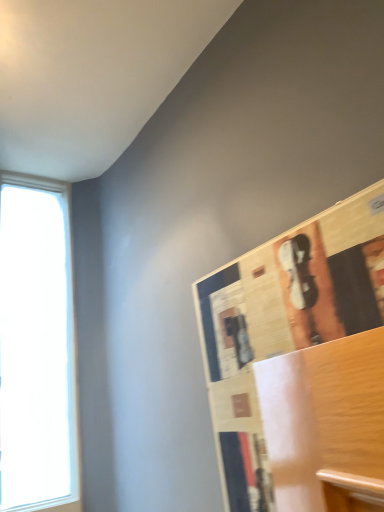
Question: Should I look upward or downward to see wooden bulletin board at upper right?

Choices:
 (A) down
 (B) up

Answer: (A)

Question: Does transparent glass window at left have a lesser width compared to wooden bulletin board at upper right?

Choices:
 (A) yes
 (B) no

Answer: (B)

Question: Is transparent glass window at left positioned far away from wooden bulletin board at upper right?

Choices:
 (A) yes
 (B) no

Answer: (B)

Question: From a real-world perspective, is transparent glass window at left physically below wooden bulletin board at upper right?

Choices:
 (A) no
 (B) yes

Answer: (A)

Question: Considering the relative positions of transparent glass window at left and wooden bulletin board at upper right in the image provided, is transparent glass window at left behind wooden bulletin board at upper right?

Choices:
 (A) yes
 (B) no

Answer: (A)

Question: From the image's perspective, does transparent glass window at left appear higher than wooden bulletin board at upper right?

Choices:
 (A) yes
 (B) no

Answer: (B)

Question: Does transparent glass window at left appear on the right side of wooden bulletin board at upper right?

Choices:
 (A) no
 (B) yes

Answer: (A)

Question: Is wooden bulletin board at upper right in front of transparent glass window at left?

Choices:
 (A) no
 (B) yes

Answer: (B)

Question: Can you confirm if wooden bulletin board at upper right is wider than transparent glass window at left?

Choices:
 (A) yes
 (B) no

Answer: (B)

Question: From a real-world perspective, is wooden bulletin board at upper right beneath transparent glass window at left?

Choices:
 (A) yes
 (B) no

Answer: (A)

Question: Does wooden bulletin board at upper right have a smaller size compared to transparent glass window at left?

Choices:
 (A) yes
 (B) no

Answer: (A)

Question: Is wooden bulletin board at upper right thinner than transparent glass window at left?

Choices:
 (A) no
 (B) yes

Answer: (B)

Question: From a real-world perspective, is wooden bulletin board at upper right located higher than transparent glass window at left?

Choices:
 (A) yes
 (B) no

Answer: (B)

Question: From their relative heights in the image, would you say transparent glass window at left is taller or shorter than wooden bulletin board at upper right?

Choices:
 (A) tall
 (B) short

Answer: (A)